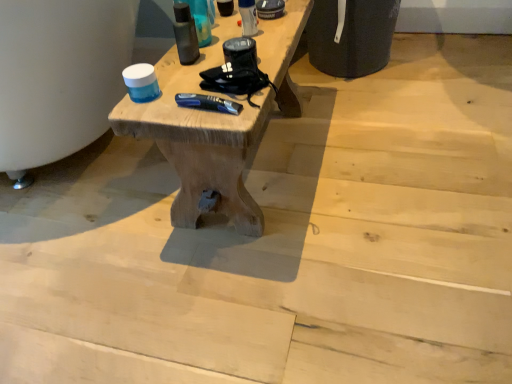
I want to click on vacant space that is to the left of wooden table at center, so click(92, 206).